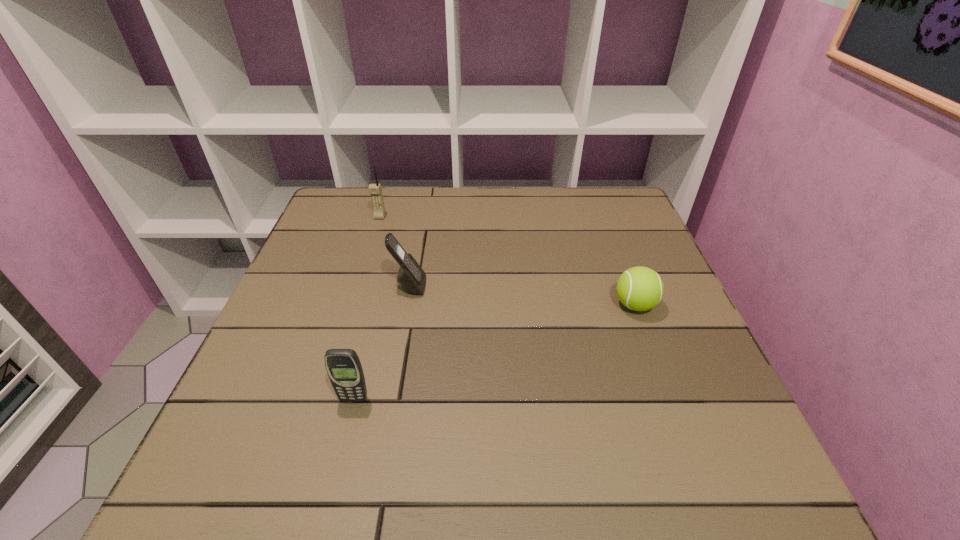
Identify which cellular telephone is the second nearest to the second farthest cellular telephone. Please provide its 2D coordinates. Your answer should be formatted as a tuple, i.e. [(x, y)], where the tuple contains the x and y coordinates of a point satisfying the conditions above.

[(343, 366)]

Point out which cellular telephone is positioned as the second nearest to the farthest cellular telephone. Please provide its 2D coordinates. Your answer should be formatted as a tuple, i.e. [(x, y)], where the tuple contains the x and y coordinates of a point satisfying the conditions above.

[(343, 366)]

This screenshot has height=540, width=960. I want to click on free spot that satisfies the following two spatial constraints: 1. on the front-facing side of the rightmost object; 2. on the left side of the second nearest cellular telephone, so click(406, 305).

At what (x,y) coordinates should I click in order to perform the action: click on free spot that satisfies the following two spatial constraints: 1. on the front of the rightmost object, where the keypad is located; 2. on the left side of the farthest object. Please return your answer as a coordinate pair (x, y). Looking at the image, I should click on (352, 305).

At what (x,y) coordinates should I click in order to perform the action: click on vacant space that satisfies the following two spatial constraints: 1. on the back side of the tennis ball; 2. on the front-facing side of the second farthest cellular telephone. Please return your answer as a coordinate pair (x, y). Looking at the image, I should click on point(628,286).

Image resolution: width=960 pixels, height=540 pixels. I want to click on free space that satisfies the following two spatial constraints: 1. on the front-facing side of the second farthest cellular telephone; 2. on the right side of the rightmost object, so pyautogui.click(x=406, y=305).

Image resolution: width=960 pixels, height=540 pixels. Identify the location of vacant space that satisfies the following two spatial constraints: 1. on the front-facing side of the second farthest cellular telephone; 2. on the back side of the shortest object. (406, 305).

This screenshot has width=960, height=540. I want to click on vacant space that satisfies the following two spatial constraints: 1. on the front of the tennis ball, where the keypad is located; 2. on the left side of the leftmost object, so click(352, 305).